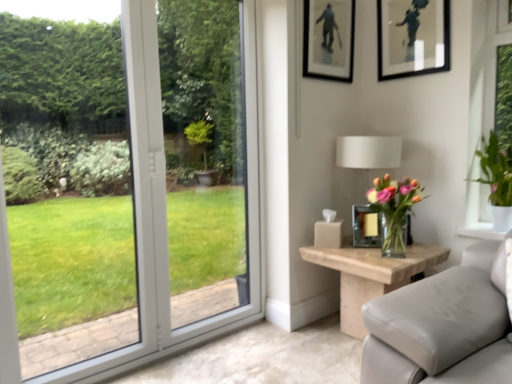
Where is `free location to the left of metallic gold picture frame at right, positioned as the 2th picture frame in right-to-left order`? free location to the left of metallic gold picture frame at right, positioned as the 2th picture frame in right-to-left order is located at coordinates (342, 249).